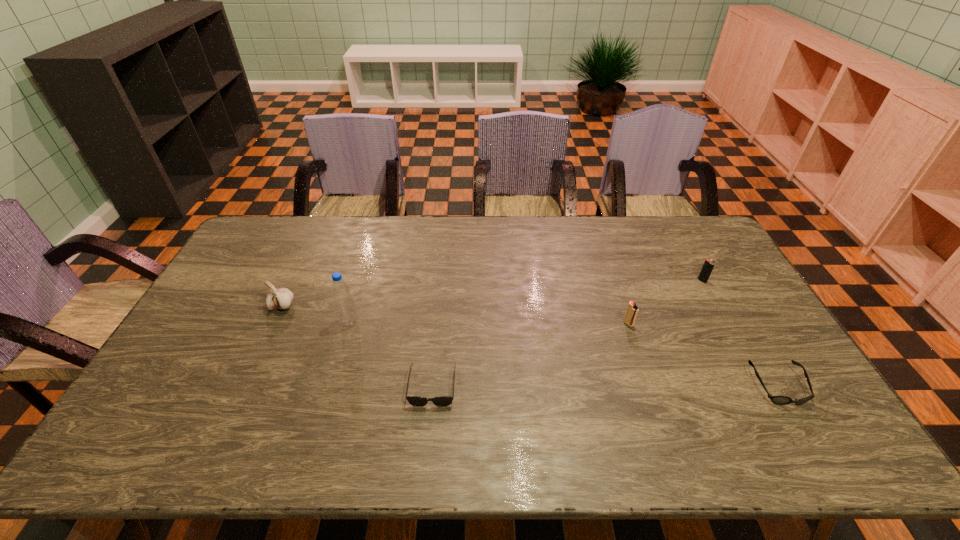
Where is `the fifth object from right to left`? the fifth object from right to left is located at coordinates (340, 290).

Where is `the tallest object`? The width and height of the screenshot is (960, 540). the tallest object is located at coordinates click(x=340, y=290).

This screenshot has height=540, width=960. In order to click on the fifth nearest object in this screenshot , I will do `click(281, 298)`.

You are a GUI agent. You are given a task and a screenshot of the screen. Output one action in this format:
    pyautogui.click(x=<x>, y=<y>)
    Task: Click on the garlic
    The width and height of the screenshot is (960, 540).
    Given the screenshot: What is the action you would take?
    pyautogui.click(x=281, y=298)

I want to click on the farthest object, so click(708, 265).

Where is `the farther igniter`? The width and height of the screenshot is (960, 540). the farther igniter is located at coordinates (708, 265).

Locate an element on the screen. This screenshot has height=540, width=960. the left igniter is located at coordinates (632, 310).

The width and height of the screenshot is (960, 540). I want to click on the third object from right to left, so click(632, 310).

You are a GUI agent. You are given a task and a screenshot of the screen. Output one action in this format:
    pyautogui.click(x=<x>, y=<y>)
    Task: Click on the left sunglasses
    The width and height of the screenshot is (960, 540).
    Given the screenshot: What is the action you would take?
    pyautogui.click(x=418, y=401)

The height and width of the screenshot is (540, 960). I want to click on the right sunglasses, so coord(779,400).